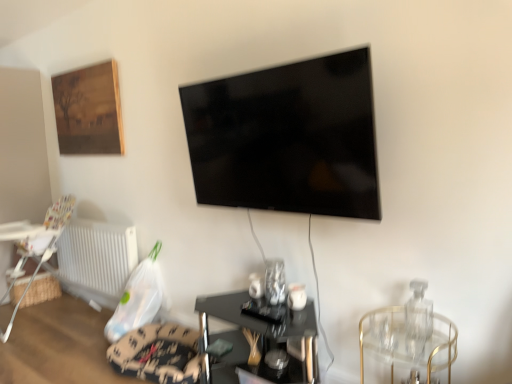
You are a GUI agent. You are given a task and a screenshot of the screen. Output one action in this format:
    pyautogui.click(x=<x>, y=<y>)
    Task: Click on the free space in front of white plastic highchair at lower left
    The height and width of the screenshot is (384, 512).
    Given the screenshot: What is the action you would take?
    [37, 347]